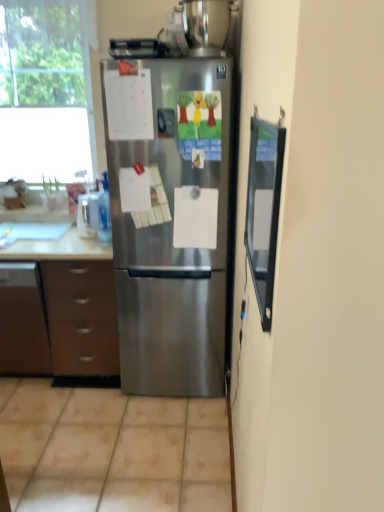
Question: Does stainless steel refrigerator at center have a lesser width compared to white glossy sink at left?

Choices:
 (A) no
 (B) yes

Answer: (A)

Question: From the image's perspective, would you say stainless steel refrigerator at center is positioned over white glossy sink at left?

Choices:
 (A) no
 (B) yes

Answer: (A)

Question: Is there a large distance between stainless steel refrigerator at center and white glossy sink at left?

Choices:
 (A) yes
 (B) no

Answer: (B)

Question: Is stainless steel refrigerator at center shorter than white glossy sink at left?

Choices:
 (A) no
 (B) yes

Answer: (A)

Question: Considering the relative sizes of stainless steel refrigerator at center and white glossy sink at left in the image provided, is stainless steel refrigerator at center bigger than white glossy sink at left?

Choices:
 (A) no
 (B) yes

Answer: (B)

Question: Looking at the image, does white glossy sink at left seem bigger or smaller compared to brown matte cabinet at lower left?

Choices:
 (A) small
 (B) big

Answer: (A)

Question: Considering the positions of point (11, 225) and point (107, 309), is point (11, 225) closer or farther from the camera than point (107, 309)?

Choices:
 (A) farther
 (B) closer

Answer: (A)

Question: From the image's perspective, relative to brown matte cabinet at lower left, is white glossy sink at left above or below?

Choices:
 (A) below
 (B) above

Answer: (B)

Question: Looking at their shapes, would you say white glossy sink at left is wider or thinner than brown matte cabinet at lower left?

Choices:
 (A) wide
 (B) thin

Answer: (B)

Question: From a real-world perspective, is stainless steel refrigerator at center positioned above or below transparent glass screen door at right?

Choices:
 (A) above
 (B) below

Answer: (B)

Question: In the image, is stainless steel refrigerator at center on the left side or the right side of transparent glass screen door at right?

Choices:
 (A) left
 (B) right

Answer: (A)

Question: Based on their sizes in the image, would you say stainless steel refrigerator at center is bigger or smaller than transparent glass screen door at right?

Choices:
 (A) big
 (B) small

Answer: (A)

Question: Is point (165, 289) positioned closer to the camera than point (266, 196)?

Choices:
 (A) farther
 (B) closer

Answer: (A)

Question: From a real-world perspective, is stainless steel refrigerator at center above or below stainless steel pot at upper center, marked as the second appliance in a left-to-right arrangement?

Choices:
 (A) below
 (B) above

Answer: (A)

Question: Is stainless steel refrigerator at center bigger or smaller than stainless steel pot at upper center, marked as the second appliance in a left-to-right arrangement?

Choices:
 (A) big
 (B) small

Answer: (A)